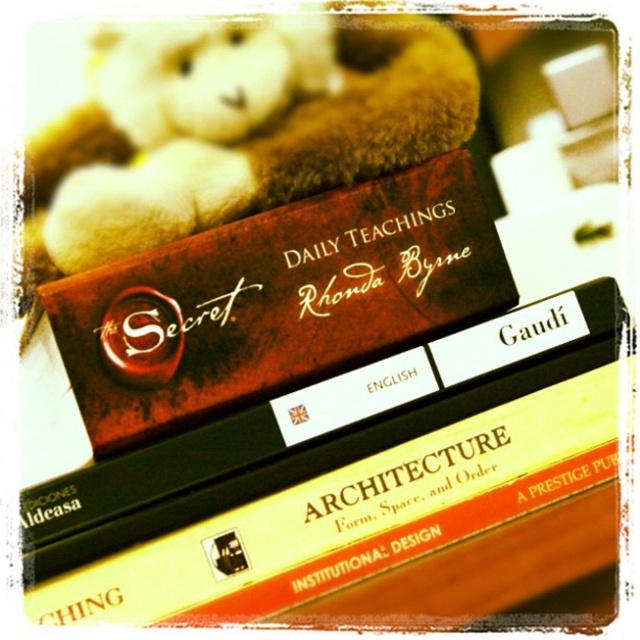
Question: Does hardcover book at upper center lie behind matte brown book at center?

Choices:
 (A) no
 (B) yes

Answer: (A)

Question: Which point is closer to the camera taking this photo?

Choices:
 (A) (49, 618)
 (B) (348, 204)

Answer: (A)

Question: Which of the following is the farthest from the observer?

Choices:
 (A) matte brown book at center
 (B) hardcover book at upper center

Answer: (A)

Question: Is hardcover book at upper center below matte brown book at center?

Choices:
 (A) yes
 (B) no

Answer: (A)

Question: Is hardcover book at upper center below matte brown book at center?

Choices:
 (A) yes
 (B) no

Answer: (A)